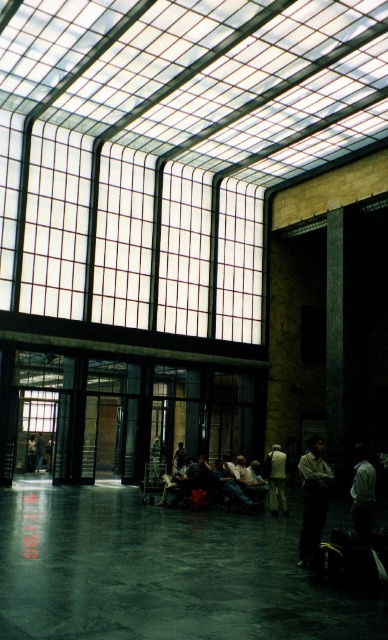
In the scene shown: Which is below, white matte shirt at lower right or light beige fabric jacket at center?

Positioned lower is light beige fabric jacket at center.

The height and width of the screenshot is (640, 388). Describe the element at coordinates (363, 493) in the screenshot. I see `white matte shirt at lower right` at that location.

Where is `white matte shirt at lower right`? The width and height of the screenshot is (388, 640). white matte shirt at lower right is located at coordinates (363, 493).

Between point (84, 225) and point (360, 492), which one is positioned behind?

Point (84, 225)

Who is taller, clear glass windows at upper center or white matte shirt at lower right?

Standing taller between the two is clear glass windows at upper center.

Is point (195, 225) closer to camera compared to point (358, 531)?

No, it is not.

This screenshot has width=388, height=640. I want to click on clear glass windows at upper center, so click(x=138, y=241).

Who is positioned more to the right, white matte shirt at lower right or dark gray jeans at lower left?

From the viewer's perspective, white matte shirt at lower right appears more on the right side.

Looking at this image, does white matte shirt at lower right have a smaller size compared to dark gray jeans at lower left?

Actually, white matte shirt at lower right might be larger than dark gray jeans at lower left.

Locate an element on the screen. Image resolution: width=388 pixels, height=640 pixels. white matte shirt at lower right is located at coordinates (363, 493).